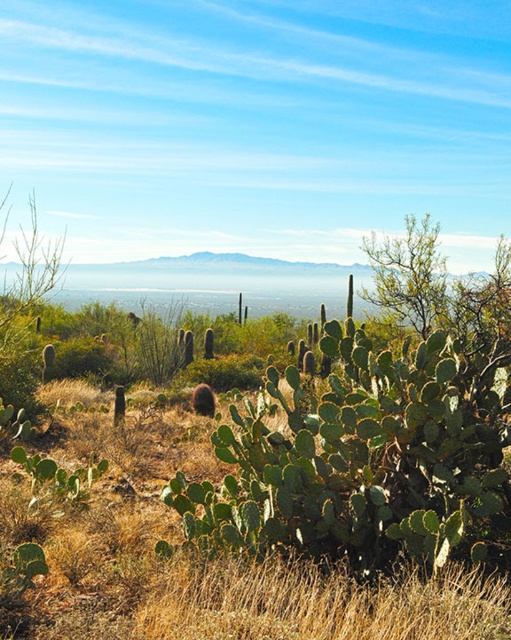
You are a desert explorer who needs to determine the tallest plant in the center of the image. Which one is taller between the green spiny cactus at center and the green leafy grass at center?

The green spiny cactus at center is taller than the green leafy grass at center according to the description.

In the scene shown: You are standing in the desert and see the green spiny cactus at center. If you walk straight ahead, will you encounter the cactus before reaching the midground saguaro cacti?

The green spiny cactus at center is located at point [368,458], so yes, you will encounter the green spiny cactus at center before reaching the midground saguaro cacti since it is closer to your current position.

From the picture: You are standing in the desert scene described. There is a point marked at coordinates (368,458). What object does this point correspond to?

The point at coordinates (368,458) corresponds to the green spiny cactus at center.